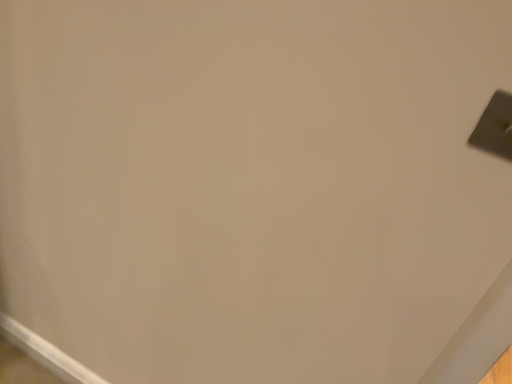
You are a GUI agent. You are given a task and a screenshot of the screen. Output one action in this format:
    pyautogui.click(x=<x>, y=<y>)
    Task: Click on the satin silver switch at upper right
    
    Given the screenshot: What is the action you would take?
    pyautogui.click(x=495, y=127)

The height and width of the screenshot is (384, 512). What do you see at coordinates (495, 127) in the screenshot?
I see `satin silver switch at upper right` at bounding box center [495, 127].

At what (x,y) coordinates should I click in order to perform the action: click on satin silver switch at upper right. Please return your answer as a coordinate pair (x, y). The height and width of the screenshot is (384, 512). Looking at the image, I should click on (495, 127).